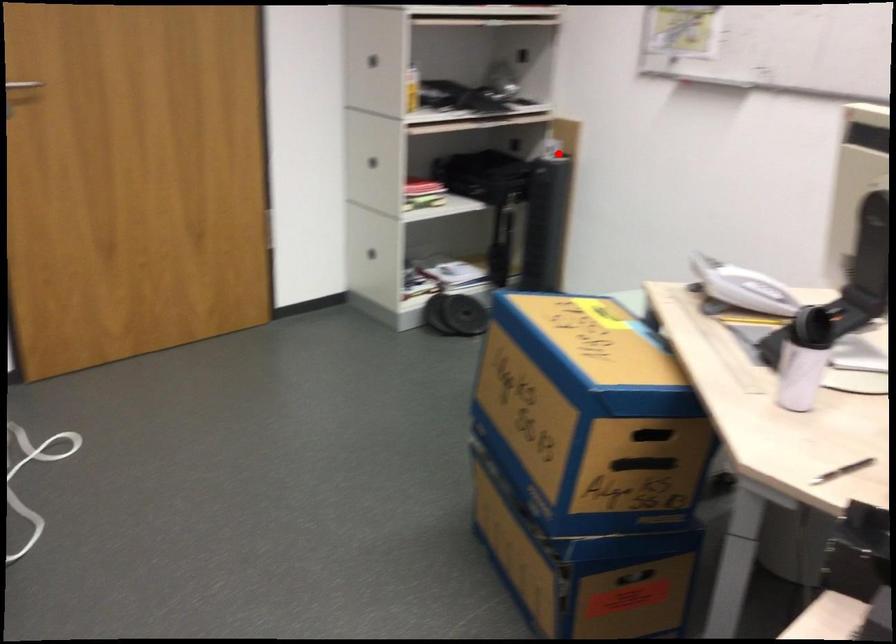
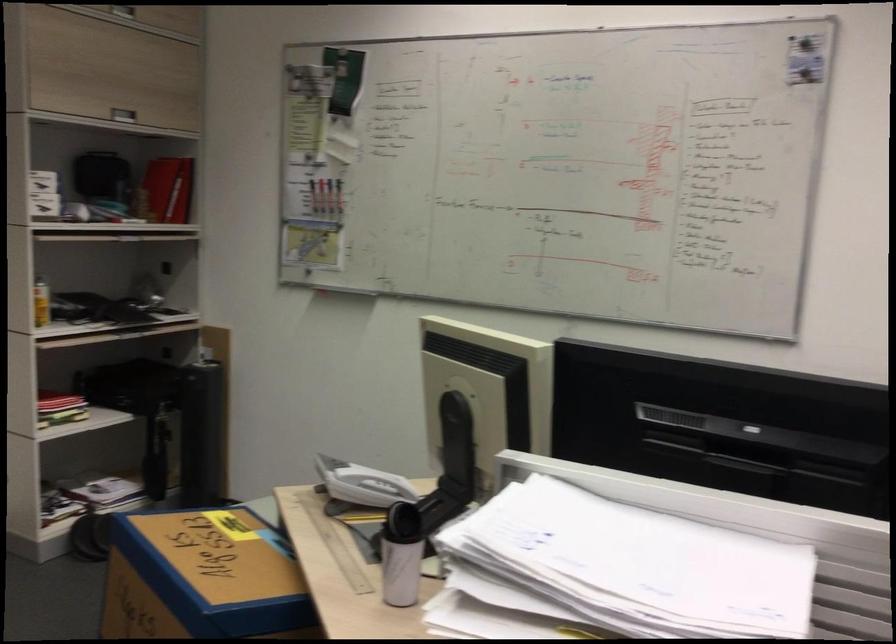
Locate, in the second image, the point that corresponds to the highlighted location in the first image.

(213, 359)